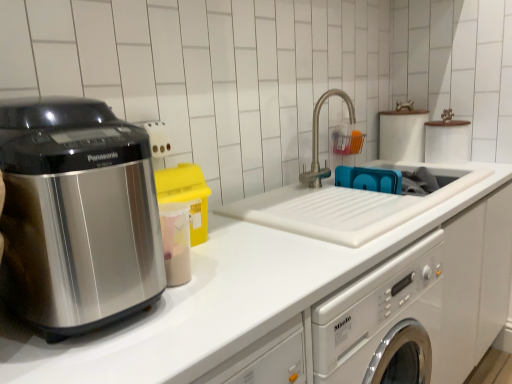
Question: From the image's perspective, would you say satin metallic appliance at left is positioned over white matte countertop at center?

Choices:
 (A) no
 (B) yes

Answer: (B)

Question: Considering the relative sizes of satin metallic appliance at left and white matte countertop at center in the image provided, is satin metallic appliance at left bigger than white matte countertop at center?

Choices:
 (A) no
 (B) yes

Answer: (A)

Question: Does satin metallic appliance at left lie in front of white matte countertop at center?

Choices:
 (A) yes
 (B) no

Answer: (A)

Question: Can we say satin metallic appliance at left lies outside white matte countertop at center?

Choices:
 (A) yes
 (B) no

Answer: (A)

Question: Is satin metallic appliance at left wider than white matte countertop at center?

Choices:
 (A) no
 (B) yes

Answer: (A)

Question: Does satin metallic appliance at left have a smaller size compared to white matte countertop at center?

Choices:
 (A) yes
 (B) no

Answer: (A)

Question: From the image's perspective, is white matte countertop at center located above brushed metal faucet at center?

Choices:
 (A) yes
 (B) no

Answer: (B)

Question: From a real-world perspective, is white matte countertop at center positioned under brushed metal faucet at center based on gravity?

Choices:
 (A) yes
 (B) no

Answer: (A)

Question: Can you confirm if white matte countertop at center is thinner than brushed metal faucet at center?

Choices:
 (A) no
 (B) yes

Answer: (A)

Question: Is white matte countertop at center at the left side of brushed metal faucet at center?

Choices:
 (A) no
 (B) yes

Answer: (B)

Question: Can you see white matte countertop at center touching brushed metal faucet at center?

Choices:
 (A) no
 (B) yes

Answer: (A)

Question: From the image's perspective, is white matte countertop at center under brushed metal faucet at center?

Choices:
 (A) yes
 (B) no

Answer: (A)

Question: Can you confirm if brushed metal faucet at center is shorter than satin metallic appliance at left?

Choices:
 (A) yes
 (B) no

Answer: (A)